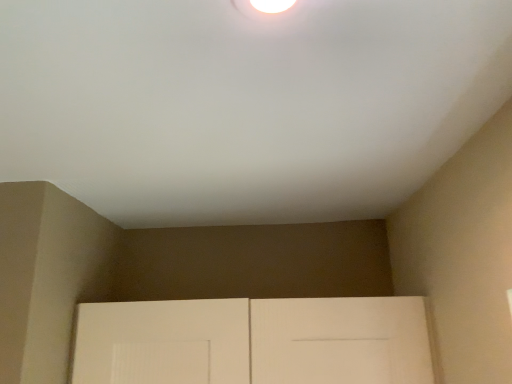
Question: From a real-world perspective, does white matte door at lower center sit lower than white glossy droplight at upper center?

Choices:
 (A) no
 (B) yes

Answer: (B)

Question: Is white matte door at lower center to the left of white glossy droplight at upper center from the viewer's perspective?

Choices:
 (A) no
 (B) yes

Answer: (B)

Question: Can you confirm if white matte door at lower center is smaller than white glossy droplight at upper center?

Choices:
 (A) no
 (B) yes

Answer: (A)

Question: Is the position of white matte door at lower center more distant than that of white glossy droplight at upper center?

Choices:
 (A) no
 (B) yes

Answer: (B)

Question: From a real-world perspective, is white matte door at lower center on white glossy droplight at upper center?

Choices:
 (A) yes
 (B) no

Answer: (B)

Question: Is white glossy droplight at upper center located within white matte door at lower center?

Choices:
 (A) yes
 (B) no

Answer: (B)

Question: From the image's perspective, is white glossy droplight at upper center located above white matte door at lower center?

Choices:
 (A) yes
 (B) no

Answer: (A)

Question: Would you say white glossy droplight at upper center is a long distance from white matte door at lower center?

Choices:
 (A) no
 (B) yes

Answer: (A)

Question: Considering the relative sizes of white glossy droplight at upper center and white matte door at lower center in the image provided, is white glossy droplight at upper center wider than white matte door at lower center?

Choices:
 (A) no
 (B) yes

Answer: (A)

Question: Is white glossy droplight at upper center closer to the viewer compared to white matte door at lower center?

Choices:
 (A) yes
 (B) no

Answer: (A)

Question: Does white glossy droplight at upper center have a smaller size compared to white matte door at lower center?

Choices:
 (A) yes
 (B) no

Answer: (A)

Question: Is white glossy droplight at upper center taller than white matte door at lower center?

Choices:
 (A) no
 (B) yes

Answer: (A)

Question: Is point (246, 0) positioned closer to the camera than point (308, 336)?

Choices:
 (A) closer
 (B) farther

Answer: (A)